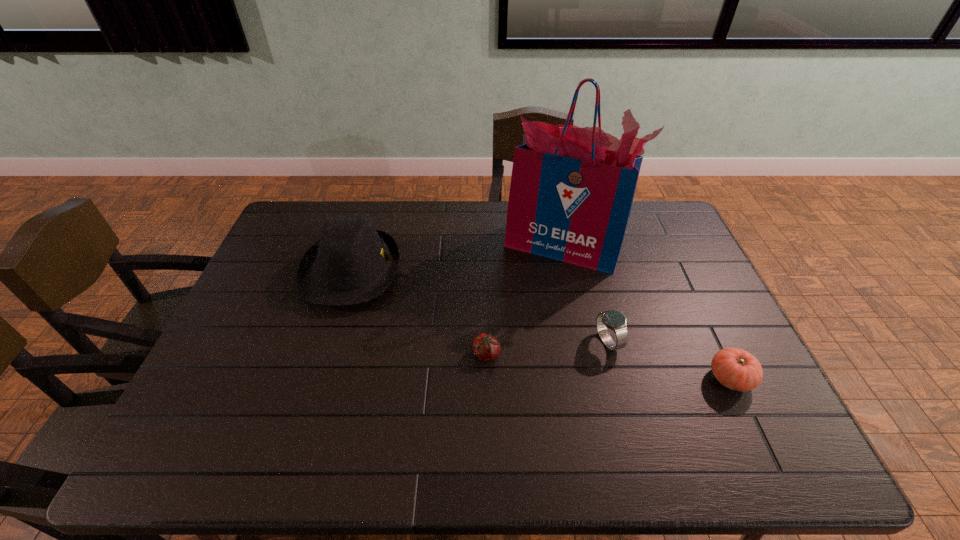
Find the location of `grocery bag`. grocery bag is located at coordinates (571, 193).

Where is `the fourth shortest object`? the fourth shortest object is located at coordinates (352, 263).

Identify the location of the leftmost object. (352, 263).

The height and width of the screenshot is (540, 960). Identify the location of watch. (615, 320).

Locate an element on the screen. the rightmost object is located at coordinates (735, 368).

At what (x,y) coordinates should I click in order to perform the action: click on the right tomato. Please return your answer as a coordinate pair (x, y). This screenshot has width=960, height=540. Looking at the image, I should click on (735, 368).

Locate an element on the screen. the shorter tomato is located at coordinates (486, 347).

This screenshot has width=960, height=540. Find the location of `the fourth object from right to left`. the fourth object from right to left is located at coordinates (486, 347).

Where is `free location located 0.170m on the front-facing side of the tallest object`? Image resolution: width=960 pixels, height=540 pixels. free location located 0.170m on the front-facing side of the tallest object is located at coordinates point(577,315).

Where is `vacant space located 0.130m on the front-facing side of the leftmost object`? The height and width of the screenshot is (540, 960). vacant space located 0.130m on the front-facing side of the leftmost object is located at coordinates (441, 271).